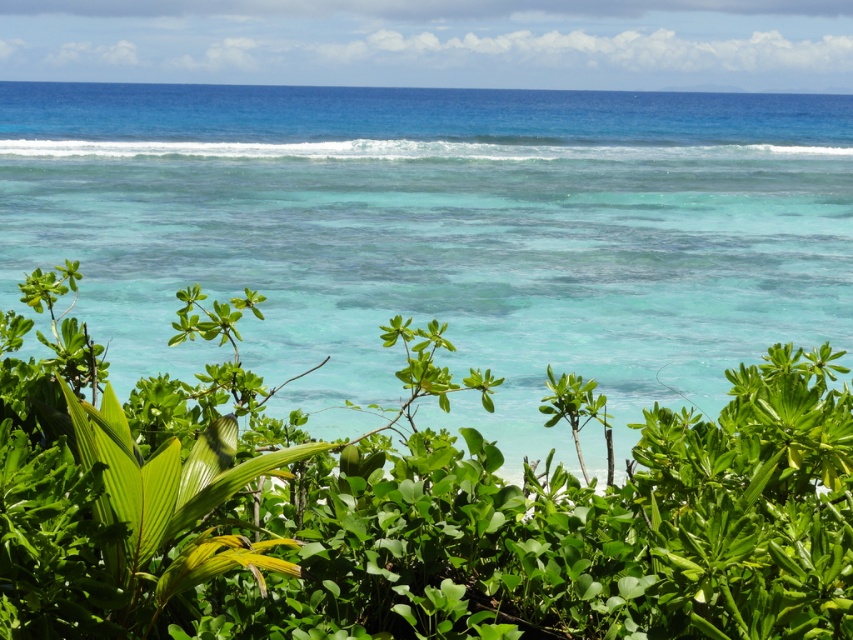
Question: Among these objects, which one is farthest from the camera?

Choices:
 (A) turquoise clear water at center
 (B) green leafy plant at center

Answer: (A)

Question: Which object appears closest to the camera in this image?

Choices:
 (A) green leafy plant at center
 (B) turquoise clear water at center

Answer: (A)

Question: Does turquoise clear water at center come behind green leafy plant at center?

Choices:
 (A) yes
 (B) no

Answer: (A)

Question: Can you confirm if turquoise clear water at center is thinner than green leafy plant at center?

Choices:
 (A) yes
 (B) no

Answer: (B)

Question: Does turquoise clear water at center appear on the right side of green leafy plant at center?

Choices:
 (A) yes
 (B) no

Answer: (A)

Question: Which of the following is the closest to the observer?

Choices:
 (A) turquoise clear water at center
 (B) green leafy plant at center

Answer: (B)